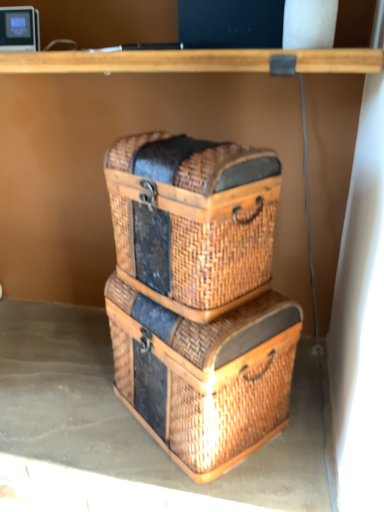
Question: Is woven brown crate at center surrounded by woven brown basket at center?

Choices:
 (A) yes
 (B) no

Answer: (B)

Question: Is woven brown basket at center facing away from woven brown crate at center?

Choices:
 (A) yes
 (B) no

Answer: (B)

Question: Is woven brown basket at center to the right of woven brown crate at center from the viewer's perspective?

Choices:
 (A) no
 (B) yes

Answer: (A)

Question: Considering the relative sizes of woven brown basket at center and woven brown crate at center in the image provided, is woven brown basket at center wider than woven brown crate at center?

Choices:
 (A) no
 (B) yes

Answer: (B)

Question: Can you confirm if woven brown basket at center is positioned to the left of woven brown crate at center?

Choices:
 (A) yes
 (B) no

Answer: (A)

Question: Based on their positions, is woven brown basket at center located to the left or right of woven brown basket at center?

Choices:
 (A) left
 (B) right

Answer: (B)

Question: Does point (200, 172) appear closer or farther from the camera than point (314, 464)?

Choices:
 (A) farther
 (B) closer

Answer: (B)

Question: Is woven brown basket at center inside or outside of woven brown basket at center?

Choices:
 (A) outside
 (B) inside

Answer: (A)

Question: Looking at the image, does woven brown basket at center seem bigger or smaller compared to woven brown basket at center?

Choices:
 (A) big
 (B) small

Answer: (A)

Question: Considering the positions of woven brown basket at center and woven brown crate at center in the image, is woven brown basket at center wider or thinner than woven brown crate at center?

Choices:
 (A) thin
 (B) wide

Answer: (A)

Question: In the image, is woven brown basket at center positioned in front of or behind woven brown crate at center?

Choices:
 (A) front
 (B) behind

Answer: (A)

Question: From the image's perspective, is woven brown basket at center above or below woven brown crate at center?

Choices:
 (A) above
 (B) below

Answer: (A)

Question: Is woven brown basket at center bigger or smaller than woven brown crate at center?

Choices:
 (A) small
 (B) big

Answer: (A)

Question: Considering their positions, is woven brown crate at center located in front of or behind woven brown basket at center?

Choices:
 (A) front
 (B) behind

Answer: (A)

Question: From a real-world perspective, is woven brown crate at center above or below woven brown basket at center?

Choices:
 (A) above
 (B) below

Answer: (A)